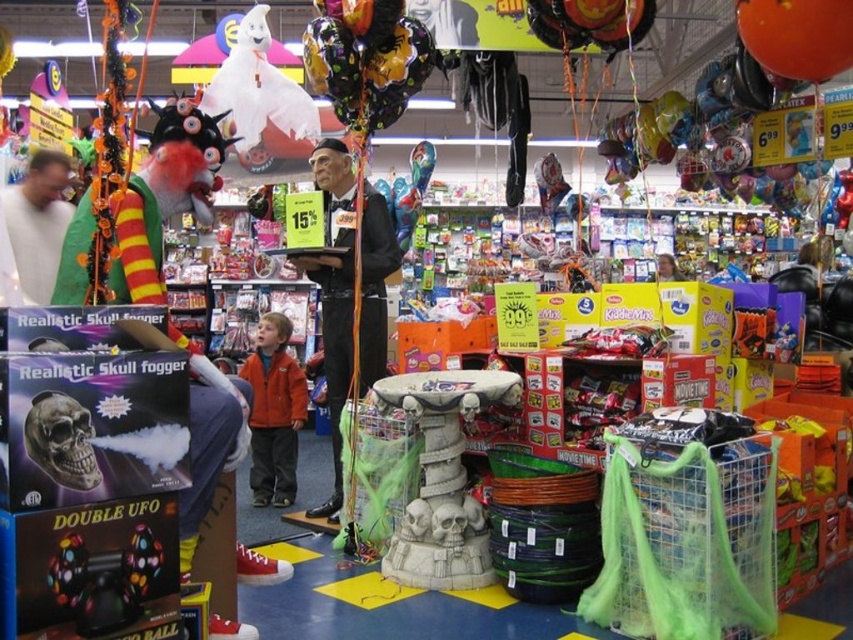
Is stone-like skull fountain at center to the right of orange fleece jacket at center from the viewer's perspective?

Yes, stone-like skull fountain at center is to the right of orange fleece jacket at center.

Between stone-like skull fountain at center and orange fleece jacket at center, which one has more height?

Standing taller between the two is orange fleece jacket at center.

Does point (434, 570) come closer to viewer compared to point (277, 484)?

That is True.

Locate an element on the screen. stone-like skull fountain at center is located at coordinates (442, 477).

Can you confirm if black glossy statue at center is positioned below orange fleece jacket at center?

Incorrect, black glossy statue at center is not positioned below orange fleece jacket at center.

Between black glossy statue at center and orange fleece jacket at center, which one appears on the left side from the viewer's perspective?

From the viewer's perspective, orange fleece jacket at center appears more on the left side.

Measure the distance between black glossy statue at center and camera.

The distance of black glossy statue at center from camera is 3.37 meters.

Find the location of a particular element. This screenshot has width=853, height=640. black glossy statue at center is located at coordinates (334, 292).

Describe the element at coordinates (442, 477) in the screenshot. I see `stone-like skull fountain at center` at that location.

Is stone-like skull fountain at center taller than black glossy statue at center?

Incorrect, stone-like skull fountain at center's height is not larger of black glossy statue at center's.

Describe the element at coordinates (442, 477) in the screenshot. The image size is (853, 640). I see `stone-like skull fountain at center` at that location.

In order to click on stone-like skull fountain at center in this screenshot , I will do `click(442, 477)`.